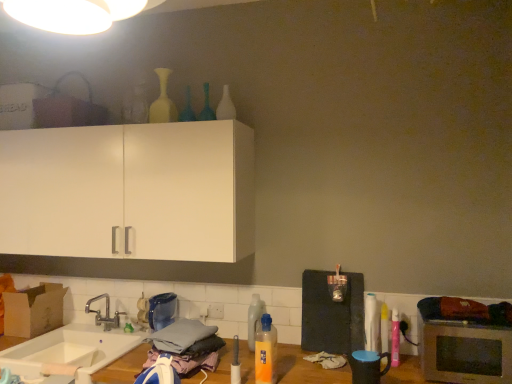
Describe the element at coordinates (367, 366) in the screenshot. The width and height of the screenshot is (512, 384). I see `matte black mug at lower right` at that location.

I want to click on matte black mug at lower right, so click(367, 366).

The image size is (512, 384). I want to click on translucent glass bottle at upper center, positioned as the seventh bottle in right-to-left order, so click(x=187, y=108).

Describe the element at coordinates (266, 352) in the screenshot. This screenshot has width=512, height=384. I see `orange translucent bottle at lower center, which appears as the sixth bottle when viewed from the left` at that location.

Identify the location of white plastic electric outlet at lower center. This screenshot has height=384, width=512. (215, 311).

How much space does white glossy bottle at right, which ranks as the seventh bottle in left-to-right order, occupy horizontally?

It is 5.41 inches.

Identify the location of matte black mug at lower right. The height and width of the screenshot is (384, 512). (367, 366).

Would you say pink plastic spray can at right, the 8th bottle when ordered from left to right, contains brown cardboard box at lower left?

No, brown cardboard box at lower left is not inside pink plastic spray can at right, the 8th bottle when ordered from left to right.

From a real-world perspective, is pink plastic spray can at right, which is counted as the first bottle, starting from the right, positioned above or below brown cardboard box at lower left?

In terms of real-world spatial position, pink plastic spray can at right, which is counted as the first bottle, starting from the right, is above brown cardboard box at lower left.

This screenshot has height=384, width=512. Identify the location of cardboard box beneath the pink plastic spray can at right, the 8th bottle when ordered from left to right (from a real-world perspective). (33, 310).

Based on the photo, how different are the orientations of silver metallic faucet at lower left and translucent glass bottle at upper center, positioned as the seventh bottle in right-to-left order, in degrees?

4.87 degrees separate the facing orientations of silver metallic faucet at lower left and translucent glass bottle at upper center, positioned as the seventh bottle in right-to-left order.

Which is more to the left, silver metallic faucet at lower left or translucent glass bottle at upper center, positioned as the seventh bottle in right-to-left order?

Positioned to the left is silver metallic faucet at lower left.

Between silver metallic faucet at lower left and translucent glass bottle at upper center, positioned as the seventh bottle in right-to-left order, which one has larger width?

silver metallic faucet at lower left is wider.

From the image's perspective, which one is positioned higher, silver metallic faucet at lower left or translucent glass bottle at upper center, the 2th bottle viewed from the left?

From the image's view, translucent glass bottle at upper center, the 2th bottle viewed from the left, is above.

Can you confirm if pink plastic spray can at right, which is counted as the first bottle, starting from the right, is shorter than translucent plastic bottle at center, the fifth bottle when ordered from left to right?

Yes.

Consider the image. How many degrees apart are the facing directions of pink plastic spray can at right, the 8th bottle when ordered from left to right, and translucent plastic bottle at center, the fifth bottle when ordered from left to right?

The angular difference between pink plastic spray can at right, the 8th bottle when ordered from left to right, and translucent plastic bottle at center, the fifth bottle when ordered from left to right, is 4.23 degrees.

Is point (385, 330) in front of point (252, 298)?

Yes, it is in front of point (252, 298).

Is pink plastic spray can at right, the 8th bottle when ordered from left to right, inside the boundaries of translucent plastic bottle at center, the fifth bottle when ordered from left to right, or outside?

pink plastic spray can at right, the 8th bottle when ordered from left to right, is located beyond the bounds of translucent plastic bottle at center, the fifth bottle when ordered from left to right.

Is white glossy bottle at right, which is counted as the second bottle, starting from the right, positioned with its back to orange translucent bottle at lower center, acting as the 3th bottle starting from the right?

No, white glossy bottle at right, which is counted as the second bottle, starting from the right,'s orientation is not away from orange translucent bottle at lower center, acting as the 3th bottle starting from the right.

Is white glossy bottle at right, which ranks as the seventh bottle in left-to-right order, thinner than orange translucent bottle at lower center, which appears as the sixth bottle when viewed from the left?

No, white glossy bottle at right, which ranks as the seventh bottle in left-to-right order, is not thinner than orange translucent bottle at lower center, which appears as the sixth bottle when viewed from the left.

Is white glossy bottle at right, which is counted as the second bottle, starting from the right, with orange translucent bottle at lower center, which appears as the sixth bottle when viewed from the left?

white glossy bottle at right, which is counted as the second bottle, starting from the right, and orange translucent bottle at lower center, which appears as the sixth bottle when viewed from the left, are clearly separated.

From a real-world perspective, which is physically below, white glossy light fixture at upper center or matte black mug at lower right?

matte black mug at lower right is physically lower.

Considering the sizes of objects white glossy light fixture at upper center and matte black mug at lower right in the image provided, who is taller, white glossy light fixture at upper center or matte black mug at lower right?

With more height is matte black mug at lower right.

Are white glossy light fixture at upper center and matte black mug at lower right making contact?

No, white glossy light fixture at upper center is not beside matte black mug at lower right.

Is white glossy light fixture at upper center inside or outside of matte black mug at lower right?

white glossy light fixture at upper center lies outside matte black mug at lower right.

Is point (454, 365) in front of point (274, 340)?

Yes, it is.

Between silver metallic microwave oven at lower right and orange translucent bottle at lower center, which appears as the sixth bottle when viewed from the left, which one has smaller width?

With smaller width is orange translucent bottle at lower center, which appears as the sixth bottle when viewed from the left.

Which of these two, silver metallic microwave oven at lower right or orange translucent bottle at lower center, acting as the 3th bottle starting from the right, is bigger?

With larger size is silver metallic microwave oven at lower right.

Are silver metallic microwave oven at lower right and orange translucent bottle at lower center, which appears as the sixth bottle when viewed from the left, far apart?

Actually, silver metallic microwave oven at lower right and orange translucent bottle at lower center, which appears as the sixth bottle when viewed from the left, are a little close together.

Consider the image. From a real-world perspective, does white glossy light fixture at upper center stand above white plastic electric outlet at lower center?

Correct, in the physical world, white glossy light fixture at upper center is higher than white plastic electric outlet at lower center.

From the image's perspective, which is above, white glossy light fixture at upper center or white plastic electric outlet at lower center?

white glossy light fixture at upper center.

Looking at this image, would you say white glossy light fixture at upper center contains white plastic electric outlet at lower center?

No.

Can you confirm if white glossy light fixture at upper center is taller than white plastic electric outlet at lower center?

No, white glossy light fixture at upper center is not taller than white plastic electric outlet at lower center.

Identify the location of cardboard box below the pink plastic spray can at right, which is counted as the first bottle, starting from the right (from the image's perspective). The width and height of the screenshot is (512, 384). (33, 310).

Locate an element on the screen. tap behind the translucent glass bottle at upper center, positioned as the seventh bottle in right-to-left order is located at coordinates (105, 313).

Estimate the real-world distances between objects in this image. Which object is closer to white glossy light fixture at upper center, translucent glass bottle at upper center, arranged as the sixth bottle when viewed from the right, or translucent glass bottle at upper center, positioned as the seventh bottle in right-to-left order?

The object closer to white glossy light fixture at upper center is translucent glass bottle at upper center, arranged as the sixth bottle when viewed from the right.

Estimate the real-world distances between objects in this image. Which object is closer to translucent plastic bottle at center, the fifth bottle when ordered from left to right, matte black mug at lower right or white glossy bottle at upper center, which is counted as the fifth bottle, starting from the right?

Based on the image, matte black mug at lower right appears to be nearer to translucent plastic bottle at center, the fifth bottle when ordered from left to right.

Which object lies nearer to the anchor point white ceramic sink at lower left, translucent glass bottle at upper center, which is counted as the third bottle, starting from the left, or matte white vase at upper center, which ranks as the eighth bottle in right-to-left order?

matte white vase at upper center, which ranks as the eighth bottle in right-to-left order, lies closer to white ceramic sink at lower left than the other object.

When comparing their distances from pink plastic spray can at right, which is counted as the first bottle, starting from the right, does translucent glass bottle at upper center, arranged as the sixth bottle when viewed from the right, or brown cardboard box at lower left seem further?

brown cardboard box at lower left.

Considering their positions, is orange translucent bottle at lower center, which appears as the sixth bottle when viewed from the left, positioned further to silver metallic microwave oven at lower right than white glossy bottle at upper center, which is the 4th bottle from left to right?

The object further to silver metallic microwave oven at lower right is white glossy bottle at upper center, which is the 4th bottle from left to right.

From the image, which object appears to be nearer to white glossy light fixture at upper center, silver metallic faucet at lower left or white ceramic sink at lower left?

white ceramic sink at lower left is closer to white glossy light fixture at upper center.

Estimate the real-world distances between objects in this image. Which object is closer to silver metallic faucet at lower left, translucent plastic bottle at center, the 4th bottle viewed from the right, or white glossy bottle at upper center, which is the 4th bottle from left to right?

translucent plastic bottle at center, the 4th bottle viewed from the right, lies closer to silver metallic faucet at lower left than the other object.

When comparing their distances from silver metallic faucet at lower left, does silver metallic microwave oven at lower right or translucent plastic bottle at center, the 4th bottle viewed from the right, seem closer?

translucent plastic bottle at center, the 4th bottle viewed from the right, is closer to silver metallic faucet at lower left.

Where is `appliance between white glossy bottle at upper center, which is counted as the fifth bottle, starting from the right, and gray fabric clothes at lower center vertically`? appliance between white glossy bottle at upper center, which is counted as the fifth bottle, starting from the right, and gray fabric clothes at lower center vertically is located at coordinates (367, 366).

This screenshot has width=512, height=384. Identify the location of sink situated between brown cardboard box at lower left and translucent plastic bottle at center, the fifth bottle when ordered from left to right, from left to right. (69, 351).

Locate an element on the screen. Image resolution: width=512 pixels, height=384 pixels. appliance between gray fabric clothes at lower center and white glossy bottle at right, which is counted as the second bottle, starting from the right is located at coordinates (367, 366).

Find the location of a particular element. This screenshot has width=512, height=384. material situated between brown cardboard box at lower left and silver metallic microwave oven at lower right from left to right is located at coordinates (185, 346).